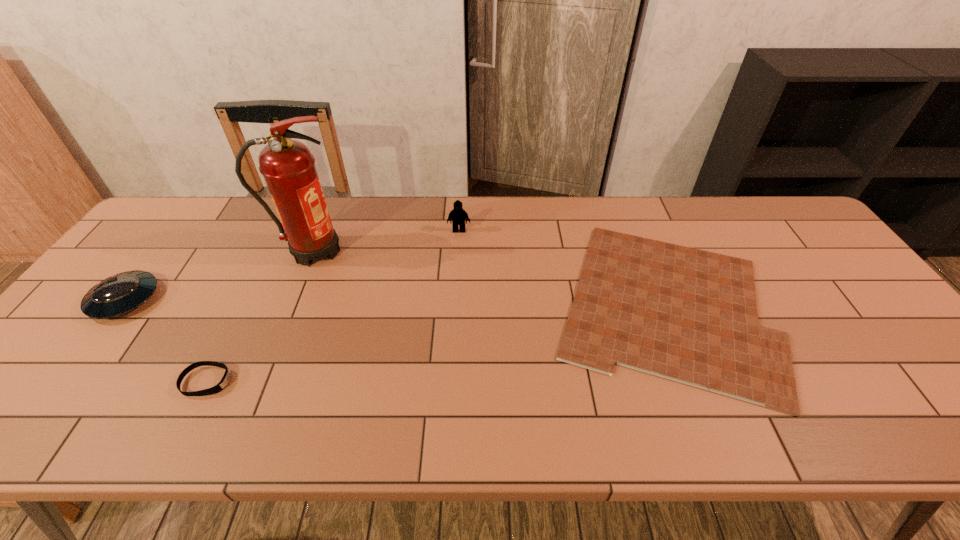
Image resolution: width=960 pixels, height=540 pixels. I want to click on free point that satisfies the following two spatial constraints: 1. on the face of the rightmost object; 2. on the right side of the second tallest object, so click(455, 305).